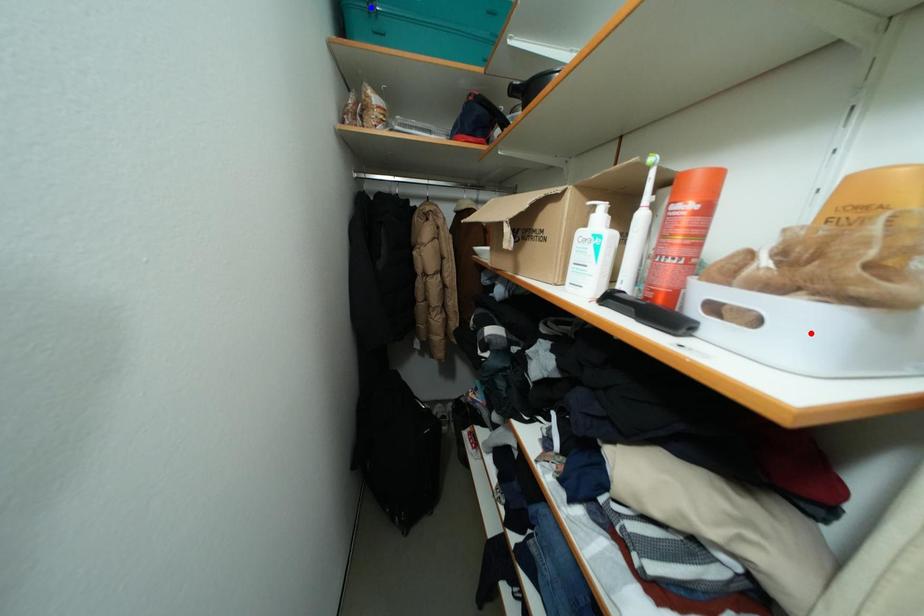
Question: In the image, two points are highlighted. Which point is nearer to the camera? Reply with the corresponding letter.

Choices:
 (A) blue point
 (B) red point

Answer: (B)